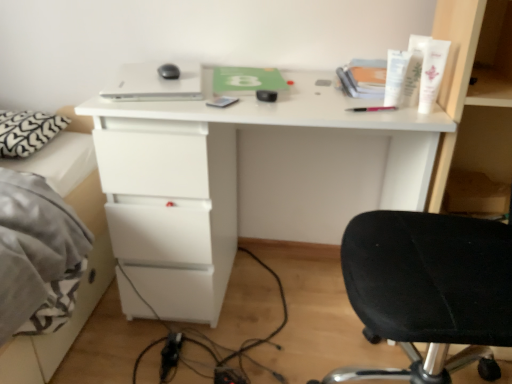
Image resolution: width=512 pixels, height=384 pixels. Find the location of `vacant area that lies between matte gray notepad at center and white cream tube at upper right, the 3th toiletry positioned from the right`. vacant area that lies between matte gray notepad at center and white cream tube at upper right, the 3th toiletry positioned from the right is located at coordinates (298, 104).